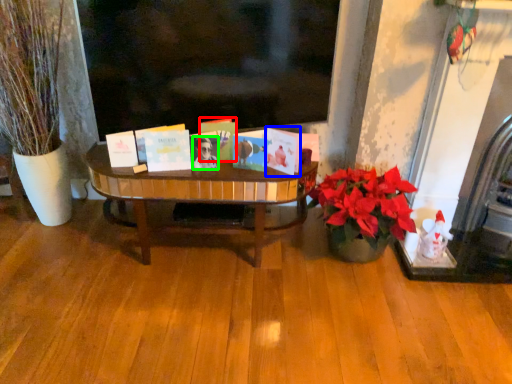
Question: Which object is positioned closest to book (highlighted by a red box)? Select from book (highlighted by a blue box) and person (highlighted by a green box).

Choices:
 (A) book
 (B) person

Answer: (B)